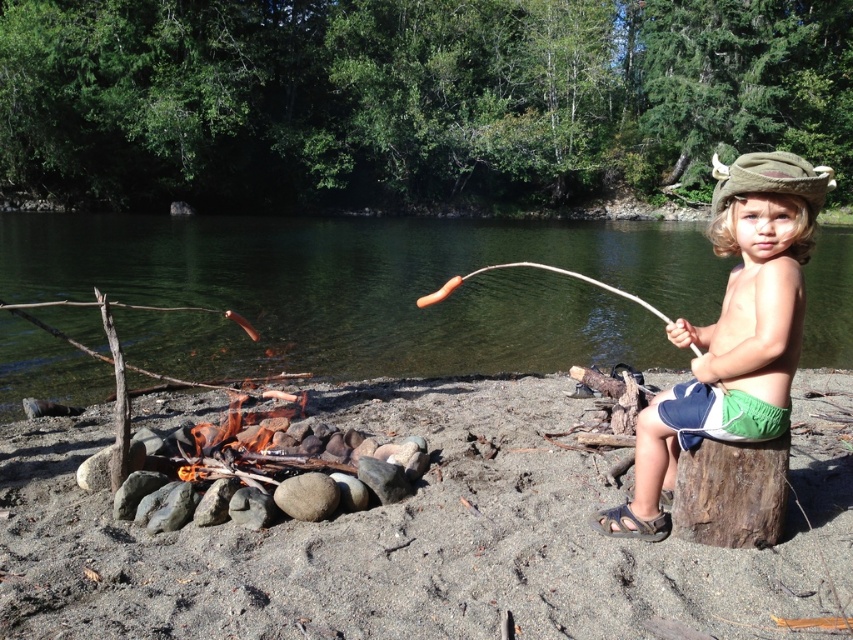
Is smooth sand at lower center positioned at the back of green water at center?

No, smooth sand at lower center is in front of green water at center.

Image resolution: width=853 pixels, height=640 pixels. Describe the element at coordinates (387, 541) in the screenshot. I see `smooth sand at lower center` at that location.

Which is behind, point (701, 580) or point (514, 330)?

The point (514, 330) is more distant.

The height and width of the screenshot is (640, 853). Identify the location of smooth sand at lower center. (387, 541).

Where is `smooth sand at lower center`? The image size is (853, 640). smooth sand at lower center is located at coordinates click(x=387, y=541).

Can you confirm if smooth sand at lower center is positioned to the right of green felt hat at upper right?

Incorrect, smooth sand at lower center is not on the right side of green felt hat at upper right.

Find the location of a particular element. Image resolution: width=853 pixels, height=640 pixels. smooth sand at lower center is located at coordinates click(x=387, y=541).

Between smooth sand at lower center and brown rough tree trunk at lower right, which one is positioned lower?

smooth sand at lower center is lower down.

In the scene shown: Is smooth sand at lower center to the left of brown rough tree trunk at lower right from the viewer's perspective?

Correct, you'll find smooth sand at lower center to the left of brown rough tree trunk at lower right.

The width and height of the screenshot is (853, 640). What do you see at coordinates (387, 541) in the screenshot?
I see `smooth sand at lower center` at bounding box center [387, 541].

I want to click on smooth sand at lower center, so click(387, 541).